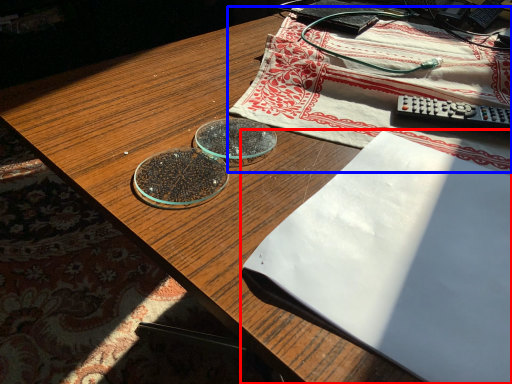
Question: Which object appears farthest to the camera in this image, notebook (highlighted by a red box) or tablecloth (highlighted by a blue box)?

Choices:
 (A) notebook
 (B) tablecloth

Answer: (B)